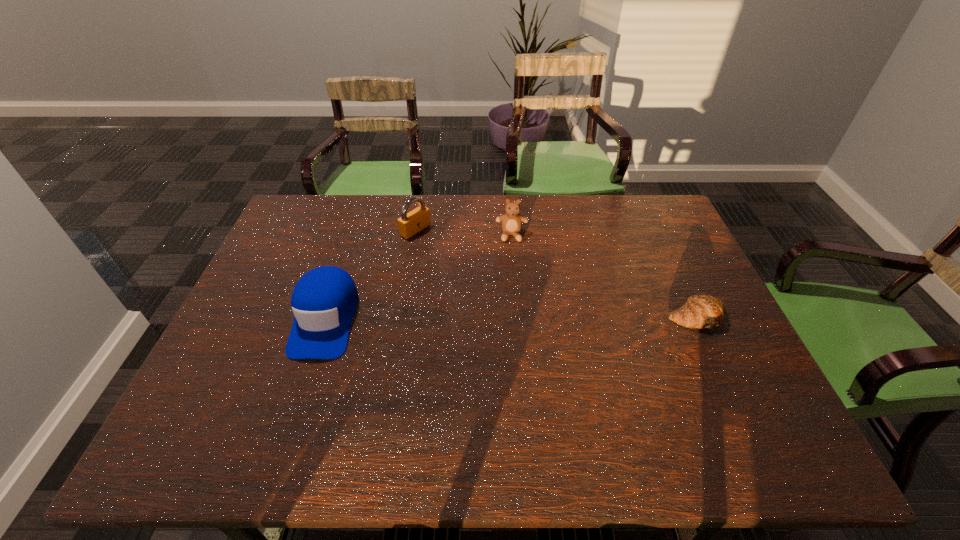
Identify the location of object that is the third nearest to the second object from right to left. (704, 311).

Where is `object identified as the second closest to the teddy bear`? object identified as the second closest to the teddy bear is located at coordinates click(324, 301).

Locate an element on the screen. free space in the image that satisfies the following two spatial constraints: 1. on the front side of the shortest object; 2. on the left side of the teddy bear is located at coordinates [x=518, y=316].

The height and width of the screenshot is (540, 960). What are the coordinates of `vacant area in the image that satisfies the following two spatial constraints: 1. on the front side of the second object from left to right; 2. on the left side of the rightmost object` in the screenshot? It's located at (401, 316).